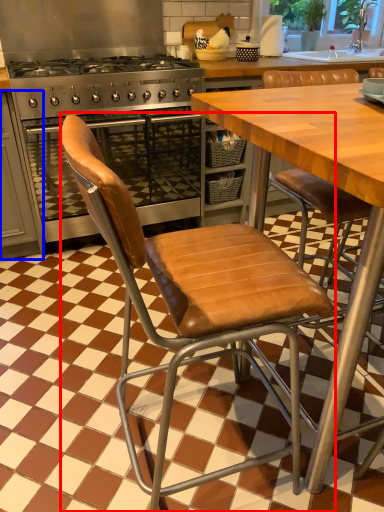
Question: Which point is further to the camera, chair (highlighted by a red box) or cabinetry (highlighted by a blue box)?

Choices:
 (A) chair
 (B) cabinetry

Answer: (B)